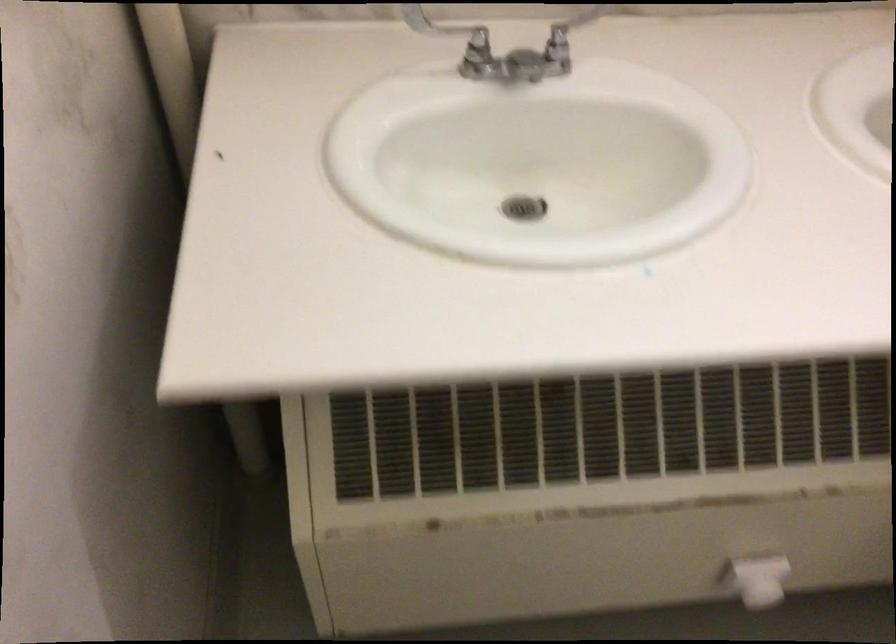
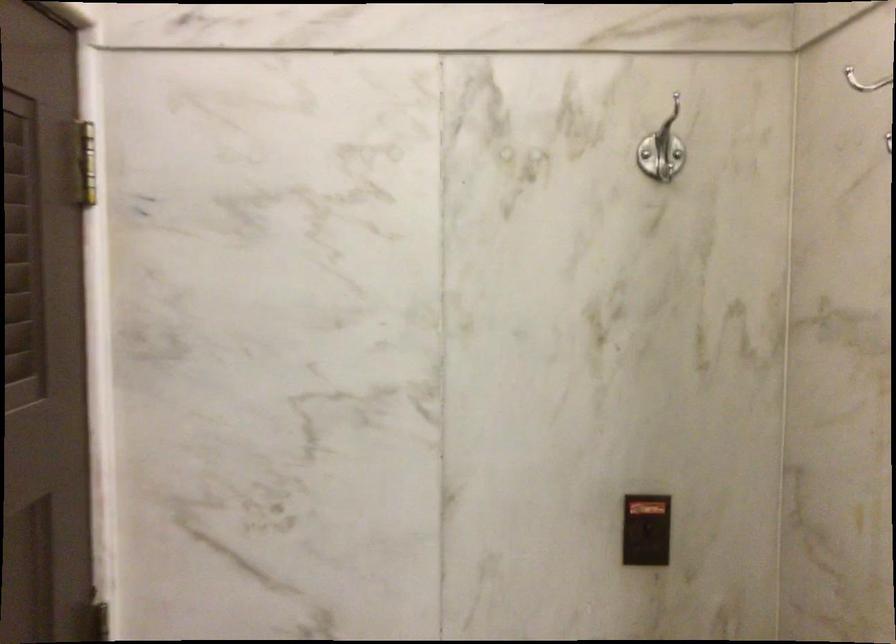
Question: The camera is either moving clockwise (left) or counter-clockwise (right) around the object. The first image is from the beginning of the video and the second image is from the end. Is the camera moving left or right when shooting the video?

Choices:
 (A) Left
 (B) Right

Answer: (B)